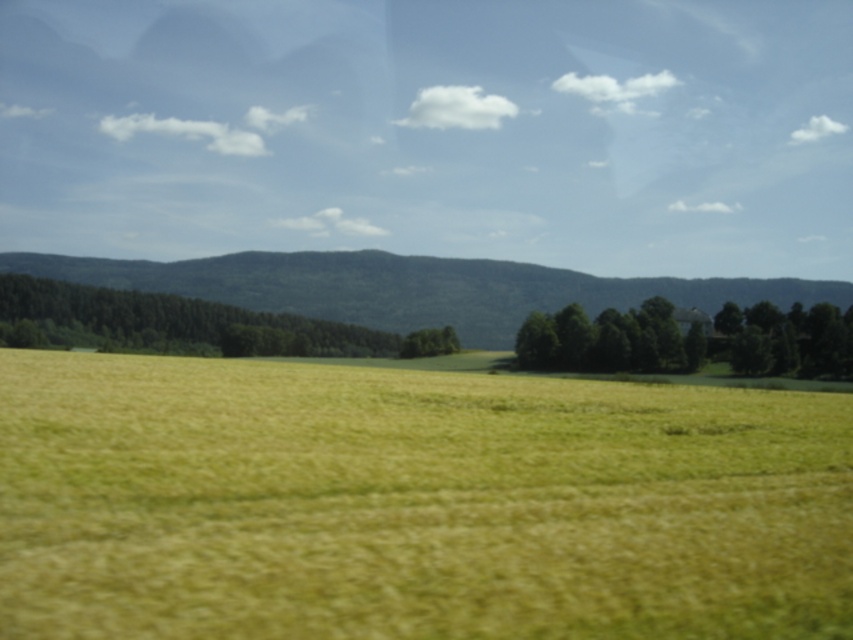
From the picture: Does green leafy trees at center lie behind green leafy tree at center?

No, it is in front of green leafy tree at center.

From the picture: Does green leafy trees at center have a larger size compared to green leafy tree at center?

Yes.

Where is `green leafy trees at center`? green leafy trees at center is located at coordinates (689, 339).

Is yellow grassy field at center wider than green leafy trees at center?

No.

Can you confirm if yellow grassy field at center is shorter than green leafy trees at center?

Correct, yellow grassy field at center is not as tall as green leafy trees at center.

The width and height of the screenshot is (853, 640). Identify the location of yellow grassy field at center. (413, 502).

This screenshot has height=640, width=853. I want to click on yellow grassy field at center, so click(x=413, y=502).

Does green leafy trees at left appear under green leafy tree at center?

Actually, green leafy trees at left is above green leafy tree at center.

Which is below, green leafy trees at left or green leafy tree at center?

green leafy tree at center

Which is in front, point (354, 355) or point (415, 356)?

Point (415, 356) is in front.

The image size is (853, 640). Find the location of `green leafy trees at left`. green leafy trees at left is located at coordinates (186, 324).